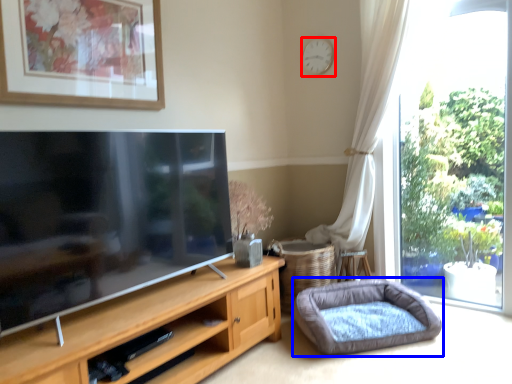
Question: Which of the following is the farthest to the observer, clock (highlighted by a red box) or dog bed (highlighted by a blue box)?

Choices:
 (A) clock
 (B) dog bed

Answer: (A)